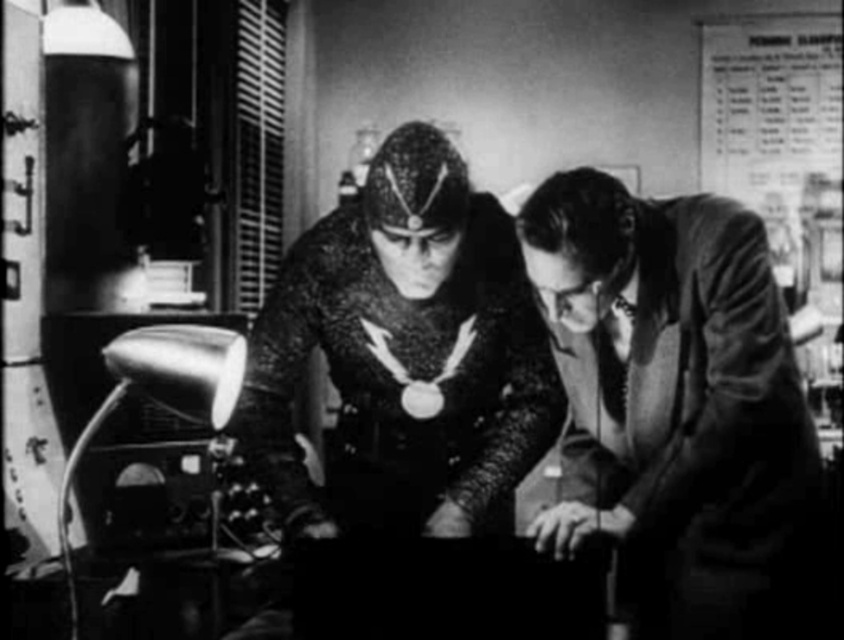
You are an astronaut navigating through a zero gravity environment in the laboratory depicted in the scene. You need to move from your current position to the airlock located at point (x=339, y=280). However, there is an obstacle at point (x=788, y=486). Can you safely maneuver around the obstacle to reach the airlock?

Point (x=788, y=486) is in front of point (x=339, y=280), so the obstacle is blocking the path to the airlock. You will need to find an alternative route to avoid the obstacle at point (x=788, y=486) and reach the airlock at point (x=339, y=280).

You are a costume designer working on a film set. You need to place a 12 inch wide prop between the metallic chainmail suit at center and the metallic mesh suit at center. Can you fit it there?

The distance between the metallic chainmail suit at center and the metallic mesh suit at center is 11.81 inches, which is slightly less than the 12 inch wide prop. Therefore, the prop cannot be placed between them without overlapping.